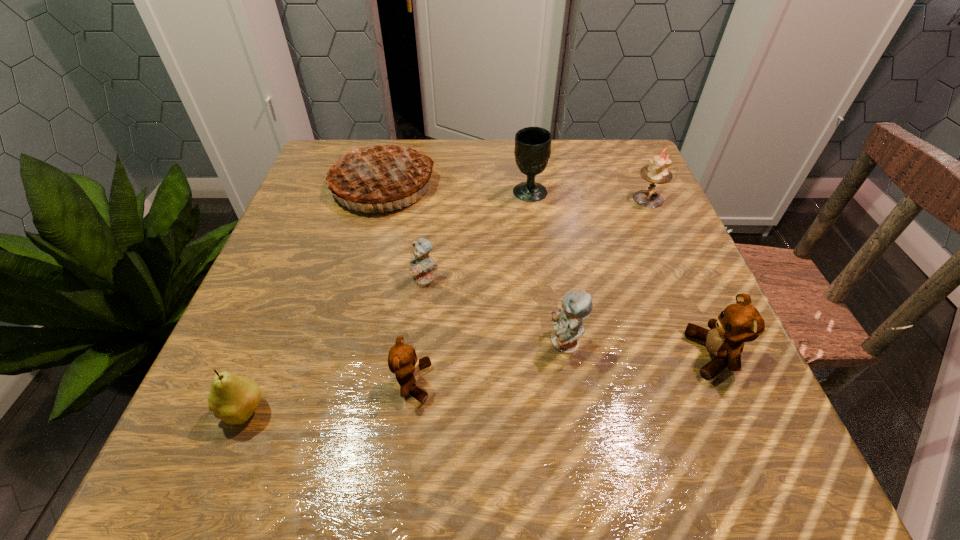
Image resolution: width=960 pixels, height=540 pixels. I want to click on free space located on the right of the pear, so click(x=302, y=410).

At what (x,y) coordinates should I click in order to perform the action: click on vacant area located on the front-facing side of the smaller blue teddy bear. Please return your answer as a coordinate pair (x, y). Looking at the image, I should click on pyautogui.click(x=414, y=381).

Find the location of a particular element. Image resolution: width=960 pixels, height=540 pixels. vacant space located on the front-facing side of the smaller brown teddy bear is located at coordinates (691, 382).

Identify the location of pie that is at the far edge. The width and height of the screenshot is (960, 540). (376, 172).

Where is `chalice positioned at the far edge`? This screenshot has height=540, width=960. chalice positioned at the far edge is located at coordinates (532, 151).

Where is `candle holder present at the far edge`? The width and height of the screenshot is (960, 540). candle holder present at the far edge is located at coordinates (657, 172).

Locate an element on the screen. Image resolution: width=960 pixels, height=540 pixels. object situated at the near edge is located at coordinates (233, 399).

At what (x,y) coordinates should I click in order to perform the action: click on pie at the left edge. Please return your answer as a coordinate pair (x, y). This screenshot has width=960, height=540. Looking at the image, I should click on (376, 172).

Identify the location of pear that is at the left edge. This screenshot has height=540, width=960. (233, 399).

Locate an element on the screen. This screenshot has width=960, height=540. candle holder located at the right edge is located at coordinates (657, 172).